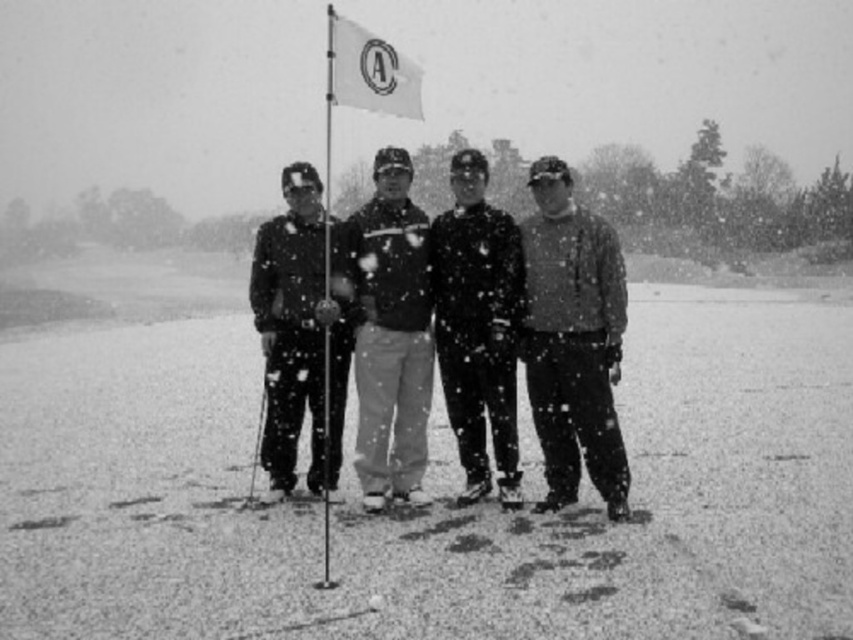
You are a photographer trying to capture a clear shot of the matte black jacket at center and the metallic ski pole at center. Since both are at the center, how can you determine which one is closer to the camera?

The matte black jacket at center is taller than the metallic ski pole at center, so it is closer to the camera.

You are an observer standing in front of the white fabric flag at center and the metallic ski pole at center. Which object is taller?

The white fabric flag at center is taller than the metallic ski pole at center.

You are planning to place a 36 inch long pole between the matte black jacket at center and the metallic ski pole at center. Will there be enough space?

The distance between the matte black jacket at center and the metallic ski pole at center is 38.20 inches, so yes, the 36 inch long pole can fit between them since it is shorter than the available space.